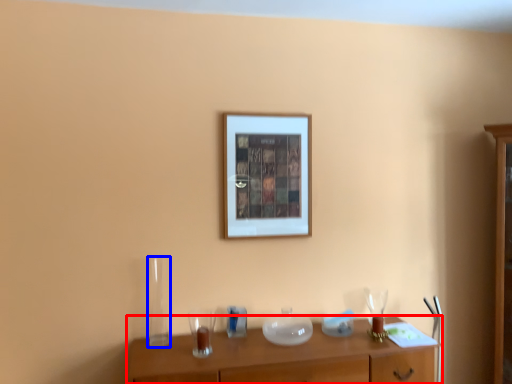
Question: Which point is further to the camera, table (highlighted by a red box) or glass vase (highlighted by a blue box)?

Choices:
 (A) table
 (B) glass vase

Answer: (B)